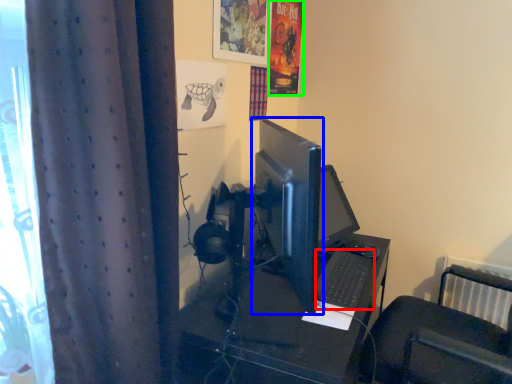
Question: Which object is positioned farthest from computer keyboard (highlighted by a red box)? Select from computer monitor (highlighted by a blue box) and poster page (highlighted by a green box).

Choices:
 (A) computer monitor
 (B) poster page

Answer: (B)